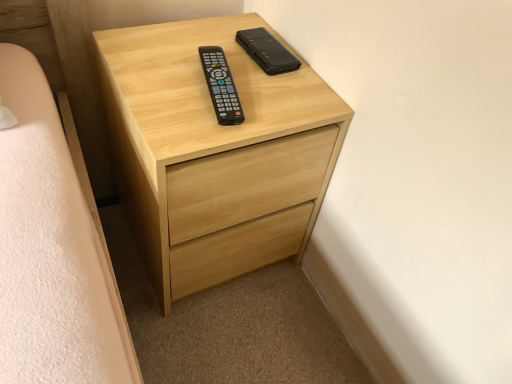
What are the coordinates of `free spot behind black plastic remote at center, which is counted as the 1th control, starting from the front` in the screenshot? It's located at (224, 54).